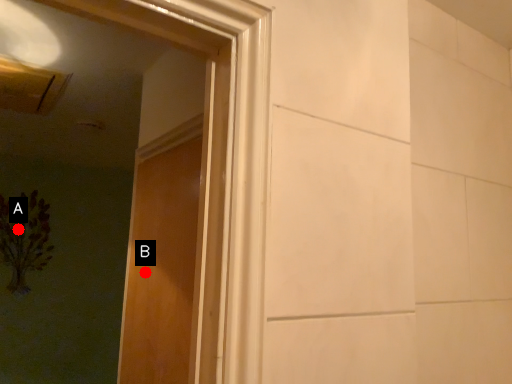
Question: Two points are circled on the image, labeled by A and B beside each circle. Which point is further to the camera?

Choices:
 (A) A is further
 (B) B is further

Answer: (A)